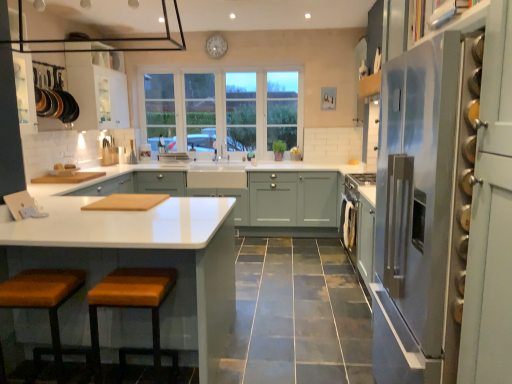
Question: Would you say black glass exhaust hood at upper center is to the left or to the right of white wood window at center in the picture?

Choices:
 (A) left
 (B) right

Answer: (A)

Question: In terms of width, does black glass exhaust hood at upper center look wider or thinner when compared to white wood window at center?

Choices:
 (A) wide
 (B) thin

Answer: (A)

Question: Estimate the real-world distances between objects in this image. Which object is farther from the satin silver refrigerator at right?

Choices:
 (A) white wood window at center
 (B) matte white cabinets at center, the second cabinetry viewed from the front
 (C) leather cushioned stool at lower left, which appears as the second stool when viewed from the right
 (D) orange leather stool at lower left, the 2th stool in the left-to-right sequence
 (E) white glossy countertop at center, the second cabinetry in the back-to-front sequence

Answer: (A)

Question: Which of these objects is positioned farthest from the black glass exhaust hood at upper center?

Choices:
 (A) white glossy countertop at center, the second cabinetry in the back-to-front sequence
 (B) matte white cabinets at center, the second cabinetry viewed from the front
 (C) leather cushioned stool at lower left, which appears as the second stool when viewed from the right
 (D) white plastic clock at upper center
 (E) white glossy drawer at center

Answer: (C)